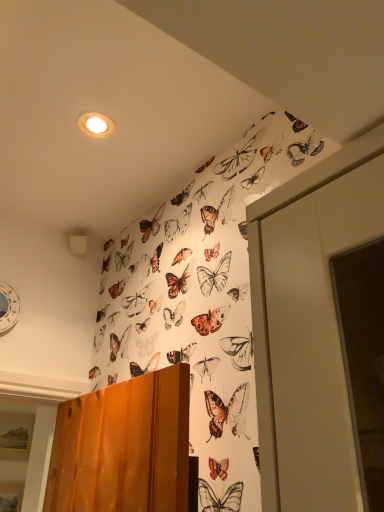
This screenshot has height=512, width=384. Describe the element at coordinates (96, 125) in the screenshot. I see `matte white light at upper center` at that location.

This screenshot has height=512, width=384. What are the coordinates of `matte white light at upper center` in the screenshot? It's located at (96, 125).

Locate an element on the screen. matte white light at upper center is located at coordinates (96, 125).